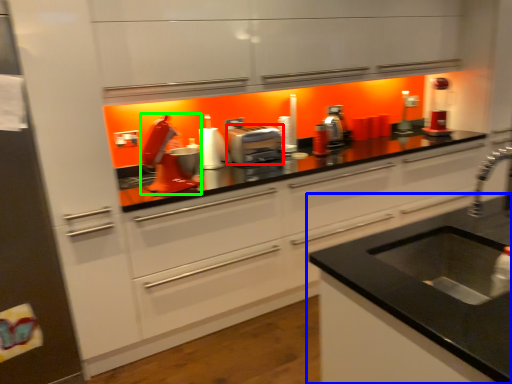
Question: Which object is positioned farthest from kitchen appliance (highlighted by a red box)? Select from countertop (highlighted by a blue box) and appliance (highlighted by a green box).

Choices:
 (A) countertop
 (B) appliance

Answer: (A)